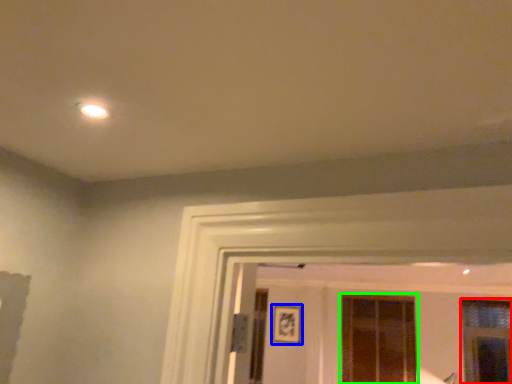
Question: Which is nearer to the window (highlighted by a red box)? picture frame (highlighted by a blue box) or window (highlighted by a green box).

Choices:
 (A) picture frame
 (B) window

Answer: (B)